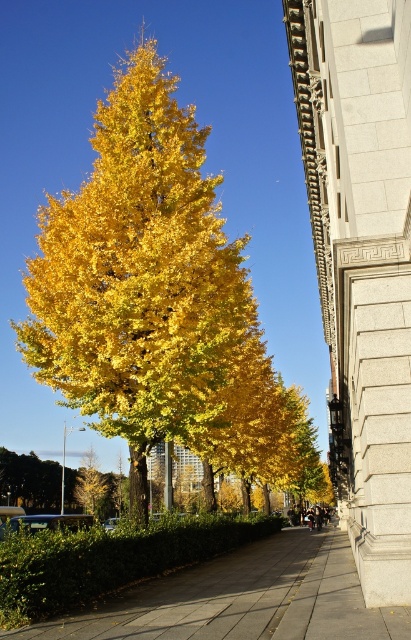
Question: Is golden leafy tree at center positioned at the back of smooth concrete pavement at center?

Choices:
 (A) yes
 (B) no

Answer: (A)

Question: Which of the following is the closest to the observer?

Choices:
 (A) smooth concrete pavement at center
 (B) golden leafy tree at center

Answer: (A)

Question: Which of the following is the closest to the observer?

Choices:
 (A) golden leafy tree at center
 (B) smooth concrete pavement at center

Answer: (B)

Question: Which object appears farthest from the camera in this image?

Choices:
 (A) smooth concrete pavement at center
 (B) golden leafy tree at center

Answer: (B)

Question: In this image, where is golden leafy tree at center located relative to smooth concrete pavement at center?

Choices:
 (A) below
 (B) above

Answer: (B)

Question: Does golden leafy tree at center have a lesser width compared to smooth concrete pavement at center?

Choices:
 (A) no
 (B) yes

Answer: (A)